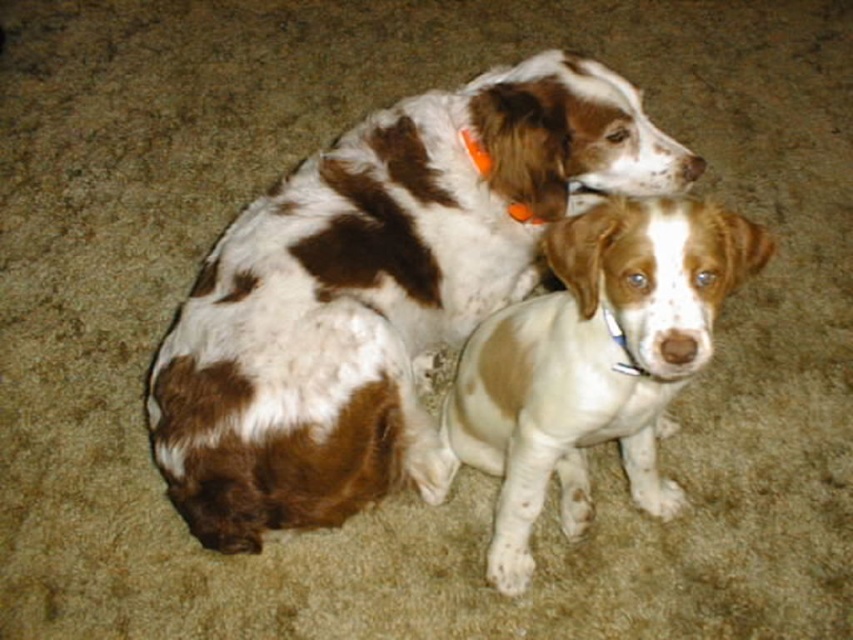
You are a photographer trying to capture the white speckled fur at center. You notice a point marked at coordinates point (593, 362). Is this point a good reference for focusing on the white speckled fur at center?

The white speckled fur at center is represented by point (593, 362), so yes, this point is an accurate reference for focusing on the white speckled fur at center.

You are a photographer setting up a shot of two dogs sitting on a beige carpet. You need to place a treat at point A and point B to guide their positions. If point A is at coordinates point (496, 97) and point B is at coordinates point (741, 228), which point is located further back from the camera?

Point point (496, 97) is behind point point (741, 228), so point A is further back from the camera.